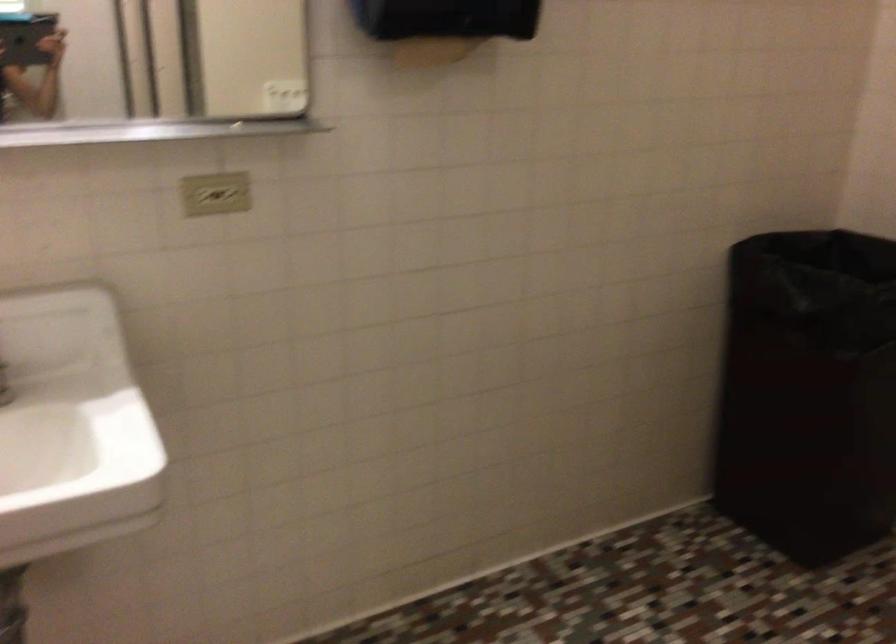
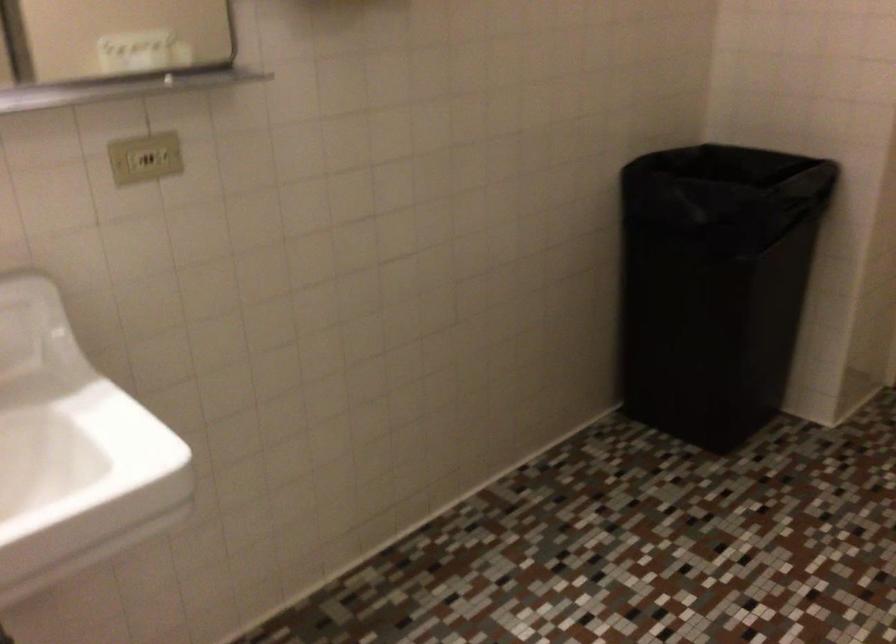
Question: In a continuous first-person perspective shot, in which direction is the camera moving?

Choices:
 (A) Left
 (B) Right
 (C) Forward
 (D) Backward

Answer: (A)